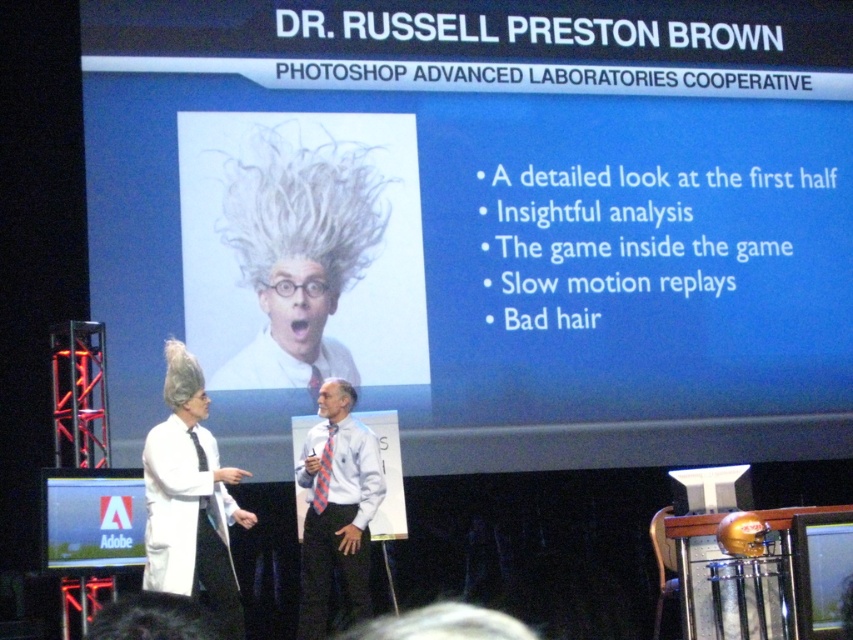
Question: Does blue matte projection screen at upper center appear on the left side of white shirt at center?

Choices:
 (A) no
 (B) yes

Answer: (A)

Question: Which object appears farthest from the camera in this image?

Choices:
 (A) matte black screen at lower left
 (B) white shirt at center

Answer: (B)

Question: Is blue matte projection screen at upper center smaller than matte black screen at lower left?

Choices:
 (A) yes
 (B) no

Answer: (B)

Question: Can you confirm if white shirt at center is positioned to the right of matte black screen at lower left?

Choices:
 (A) no
 (B) yes

Answer: (B)

Question: Which point is farther from the camera taking this photo?

Choices:
 (A) (628, 400)
 (B) (316, 429)

Answer: (A)

Question: Which object is positioned closest to the blue matte projection screen at upper center?

Choices:
 (A) matte black screen at lower left
 (B) white shirt at center

Answer: (B)